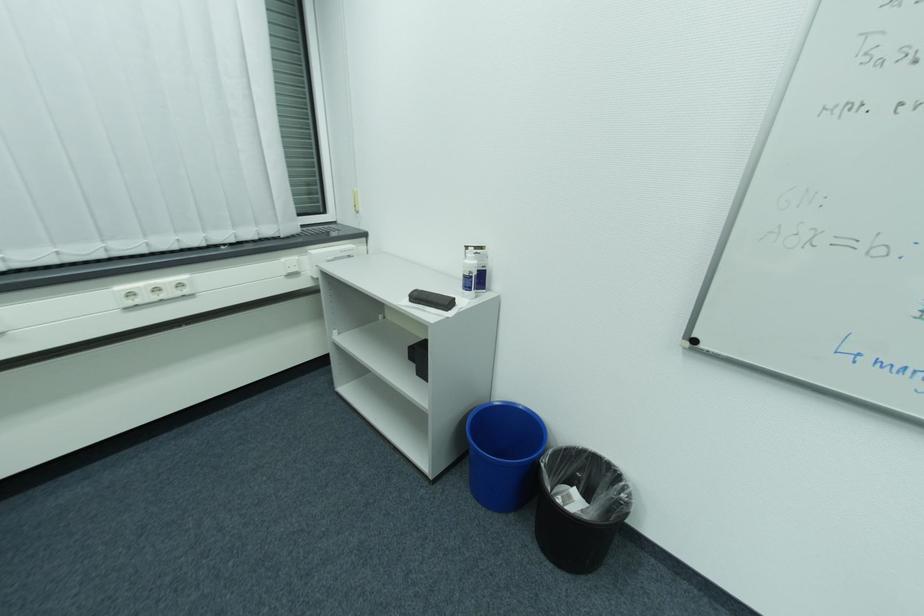
What do you see at coordinates (431, 300) in the screenshot? Image resolution: width=924 pixels, height=616 pixels. I see `the small black box` at bounding box center [431, 300].